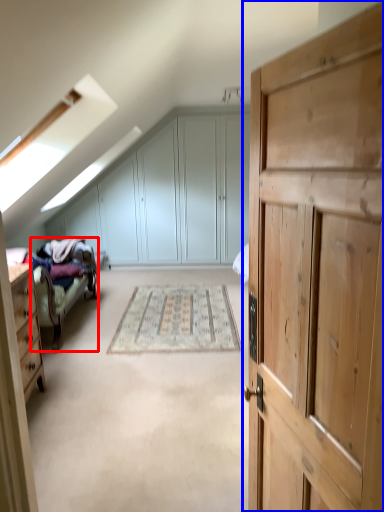
Question: Which object is further to the camera taking this photo, bed frame (highlighted by a red box) or cupboard (highlighted by a blue box)?

Choices:
 (A) bed frame
 (B) cupboard

Answer: (A)